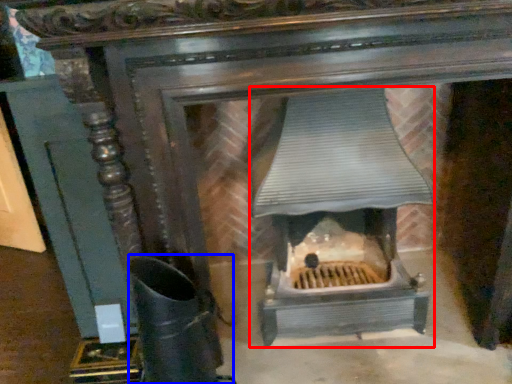
Question: Which point is closer to the camera, heater (highlighted by a red box) or boot (highlighted by a blue box)?

Choices:
 (A) heater
 (B) boot

Answer: (B)